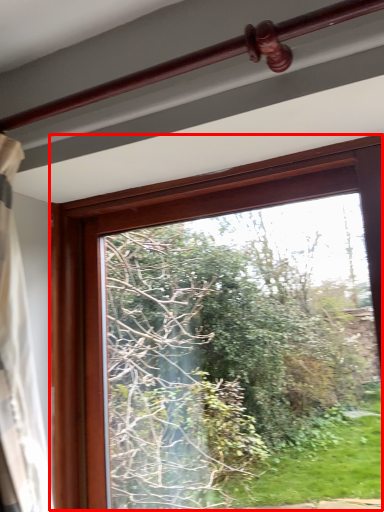
Question: From the image's perspective, what is the correct spatial relationship of window (annotated by the red box) in relation to rail?

Choices:
 (A) below
 (B) above

Answer: (A)